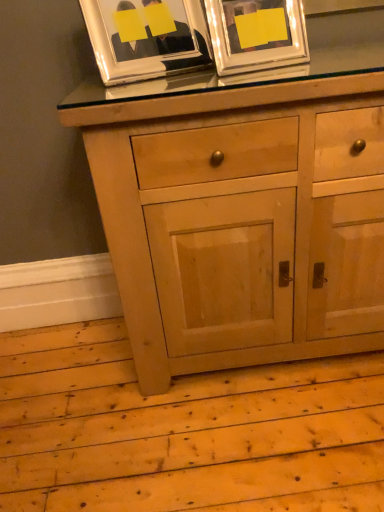
Find the location of `metallic silver picture frame at upper center, the first picture frame from the right`. metallic silver picture frame at upper center, the first picture frame from the right is located at coordinates (256, 34).

Locate an element on the screen. silver metallic picture frame at upper left, the 2th picture frame when ordered from right to left is located at coordinates (146, 38).

Consider the image. Which object is further away from the camera taking this photo, silver metallic picture frame at upper left, the 2th picture frame when ordered from right to left, or metallic silver picture frame at upper center, the first picture frame from the right?

silver metallic picture frame at upper left, the 2th picture frame when ordered from right to left, is further away from the camera.

Does silver metallic picture frame at upper left, the 2th picture frame when ordered from right to left, contain metallic silver picture frame at upper center, the second picture frame viewed from the left?

Actually, metallic silver picture frame at upper center, the second picture frame viewed from the left, is outside silver metallic picture frame at upper left, the 2th picture frame when ordered from right to left.

Is silver metallic picture frame at upper left, the 2th picture frame when ordered from right to left, next to metallic silver picture frame at upper center, the second picture frame viewed from the left?

No.

Which object is thinner, silver metallic picture frame at upper left, the 2th picture frame when ordered from right to left, or metallic silver picture frame at upper center, the second picture frame viewed from the left?

metallic silver picture frame at upper center, the second picture frame viewed from the left.

From a real-world perspective, which object stands above the other?

From a 3D spatial view, silver metallic picture frame at upper left, the 1th picture frame viewed from the left, is above.

Between natural wood cabinet at center and silver metallic picture frame at upper left, the 2th picture frame when ordered from right to left, which one has more height?

natural wood cabinet at center is taller.

Consider the image. Is natural wood cabinet at center with silver metallic picture frame at upper left, the 1th picture frame viewed from the left?

No, natural wood cabinet at center is not beside silver metallic picture frame at upper left, the 1th picture frame viewed from the left.

At what (x,y) coordinates should I click in order to perform the action: click on the 2nd picture frame behind the natural wood cabinet at center. Please return your answer as a coordinate pair (x, y). This screenshot has height=512, width=384. Looking at the image, I should click on (146, 38).

Considering the relative sizes of natural wood cabinet at center and metallic silver picture frame at upper center, the first picture frame from the right, in the image provided, is natural wood cabinet at center taller than metallic silver picture frame at upper center, the first picture frame from the right,?

Yes.

How many degrees apart are the facing directions of natural wood cabinet at center and metallic silver picture frame at upper center, the first picture frame from the right?

natural wood cabinet at center and metallic silver picture frame at upper center, the first picture frame from the right, are facing 14.5 degrees away from each other.

Is natural wood cabinet at center wider than metallic silver picture frame at upper center, the first picture frame from the right?

Correct, the width of natural wood cabinet at center exceeds that of metallic silver picture frame at upper center, the first picture frame from the right.

Could you measure the distance between natural wood cabinet at center and metallic silver picture frame at upper center, the first picture frame from the right?

natural wood cabinet at center is 15.98 inches from metallic silver picture frame at upper center, the first picture frame from the right.

In terms of width, does metallic silver picture frame at upper center, the first picture frame from the right, look wider or thinner when compared to silver metallic picture frame at upper left, the 1th picture frame viewed from the left?

Clearly, metallic silver picture frame at upper center, the first picture frame from the right, has less width compared to silver metallic picture frame at upper left, the 1th picture frame viewed from the left.

Find the location of a particular element. picture frame directly beneath the silver metallic picture frame at upper left, the 1th picture frame viewed from the left (from a real-world perspective) is located at coordinates (256, 34).

Which is behind, metallic silver picture frame at upper center, the first picture frame from the right, or silver metallic picture frame at upper left, the 2th picture frame when ordered from right to left?

silver metallic picture frame at upper left, the 2th picture frame when ordered from right to left, is further away from the camera.

Can you confirm if metallic silver picture frame at upper center, the second picture frame viewed from the left, is smaller than natural wood cabinet at center?

Indeed, metallic silver picture frame at upper center, the second picture frame viewed from the left, has a smaller size compared to natural wood cabinet at center.

Between metallic silver picture frame at upper center, the first picture frame from the right, and natural wood cabinet at center, which one is positioned in front?

Positioned in front is natural wood cabinet at center.

Does metallic silver picture frame at upper center, the first picture frame from the right, have a greater height compared to natural wood cabinet at center?

No, metallic silver picture frame at upper center, the first picture frame from the right, is not taller than natural wood cabinet at center.

Is metallic silver picture frame at upper center, the first picture frame from the right, next to natural wood cabinet at center and touching it?

No, metallic silver picture frame at upper center, the first picture frame from the right, is not beside natural wood cabinet at center.

Measure the distance from silver metallic picture frame at upper left, the 2th picture frame when ordered from right to left, to natural wood cabinet at center.

The distance of silver metallic picture frame at upper left, the 2th picture frame when ordered from right to left, from natural wood cabinet at center is 18.79 inches.

Is natural wood cabinet at center completely or partially inside silver metallic picture frame at upper left, the 2th picture frame when ordered from right to left?

No, natural wood cabinet at center is not inside silver metallic picture frame at upper left, the 2th picture frame when ordered from right to left.

Could you tell me if silver metallic picture frame at upper left, the 2th picture frame when ordered from right to left, is facing natural wood cabinet at center?

No, silver metallic picture frame at upper left, the 2th picture frame when ordered from right to left, is not oriented towards natural wood cabinet at center.

Considering the sizes of objects silver metallic picture frame at upper left, the 1th picture frame viewed from the left, and natural wood cabinet at center in the image provided, who is bigger, silver metallic picture frame at upper left, the 1th picture frame viewed from the left, or natural wood cabinet at center?

With larger size is natural wood cabinet at center.

Locate an element on the screen. The width and height of the screenshot is (384, 512). picture frame above the metallic silver picture frame at upper center, the second picture frame viewed from the left (from the image's perspective) is located at coordinates (146, 38).

At what (x,y) coordinates should I click in order to perform the action: click on the 2nd picture frame behind the natural wood cabinet at center, starting your count from the anchor. Please return your answer as a coordinate pair (x, y). This screenshot has height=512, width=384. Looking at the image, I should click on (146, 38).

When comparing their distances from natural wood cabinet at center, does metallic silver picture frame at upper center, the first picture frame from the right, or silver metallic picture frame at upper left, the 1th picture frame viewed from the left, seem closer?

metallic silver picture frame at upper center, the first picture frame from the right, is closer to natural wood cabinet at center.

Considering their positions, is natural wood cabinet at center positioned closer to silver metallic picture frame at upper left, the 1th picture frame viewed from the left, than metallic silver picture frame at upper center, the first picture frame from the right?

Among the two, metallic silver picture frame at upper center, the first picture frame from the right, is located nearer to silver metallic picture frame at upper left, the 1th picture frame viewed from the left.

Considering their positions, is silver metallic picture frame at upper left, the 1th picture frame viewed from the left, positioned further to metallic silver picture frame at upper center, the second picture frame viewed from the left, than natural wood cabinet at center?

The object further to metallic silver picture frame at upper center, the second picture frame viewed from the left, is natural wood cabinet at center.

Estimate the real-world distances between objects in this image. Which object is closer to silver metallic picture frame at upper left, the 2th picture frame when ordered from right to left, metallic silver picture frame at upper center, the first picture frame from the right, or natural wood cabinet at center?

metallic silver picture frame at upper center, the first picture frame from the right, is closer to silver metallic picture frame at upper left, the 2th picture frame when ordered from right to left.

Looking at the image, which one is located further to natural wood cabinet at center, silver metallic picture frame at upper left, the 1th picture frame viewed from the left, or metallic silver picture frame at upper center, the first picture frame from the right?

silver metallic picture frame at upper left, the 1th picture frame viewed from the left, is positioned further to the anchor natural wood cabinet at center.

Estimate the real-world distances between objects in this image. Which object is closer to metallic silver picture frame at upper center, the second picture frame viewed from the left, natural wood cabinet at center or silver metallic picture frame at upper left, the 2th picture frame when ordered from right to left?

silver metallic picture frame at upper left, the 2th picture frame when ordered from right to left, is closer to metallic silver picture frame at upper center, the second picture frame viewed from the left.

The image size is (384, 512). Identify the location of picture frame that lies between silver metallic picture frame at upper left, the 1th picture frame viewed from the left, and natural wood cabinet at center from top to bottom. (256, 34).